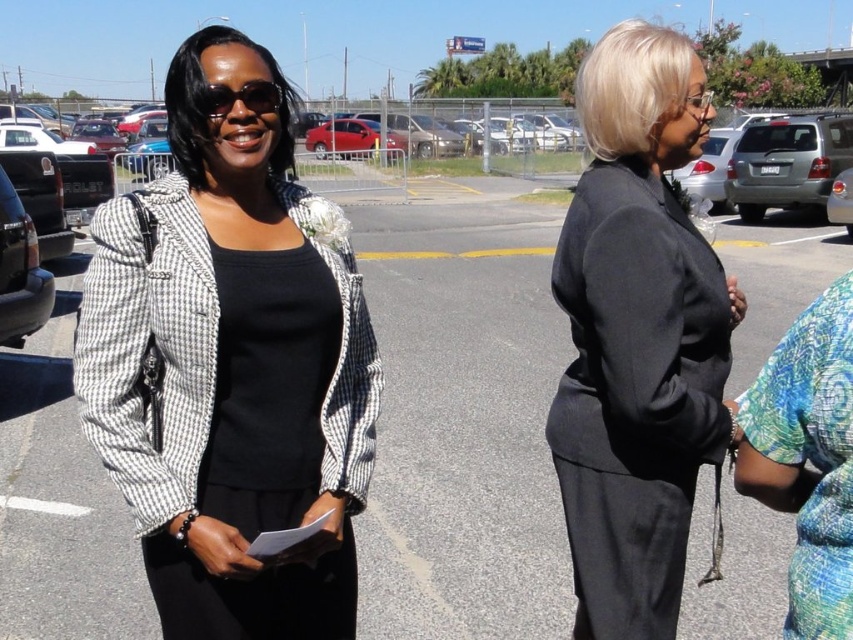
Question: Which object is farther from the camera taking this photo?

Choices:
 (A) black matte suit at right
 (B) houndstooth fabric jacket at left

Answer: (A)

Question: Is silver metallic suv at right bigger than matte black sunglasses at upper left?

Choices:
 (A) no
 (B) yes

Answer: (B)

Question: Is houndstooth fabric jacket at left to the right of matte black sunglasses at upper left from the viewer's perspective?

Choices:
 (A) no
 (B) yes

Answer: (A)

Question: Is the position of black matte suit at right more distant than that of silver metallic suv at right?

Choices:
 (A) no
 (B) yes

Answer: (A)

Question: Which point is farther to the camera?

Choices:
 (A) (196, 93)
 (B) (791, 150)
 (C) (705, 413)

Answer: (B)

Question: Estimate the real-world distances between objects in this image. Which object is closer to the matte black sunglasses at upper left?

Choices:
 (A) black matte suit at right
 (B) houndstooth fabric jacket at left
 (C) shiny red sedan at center
 (D) silver metallic suv at right

Answer: (B)